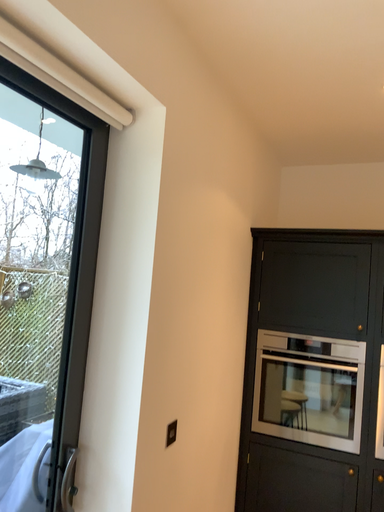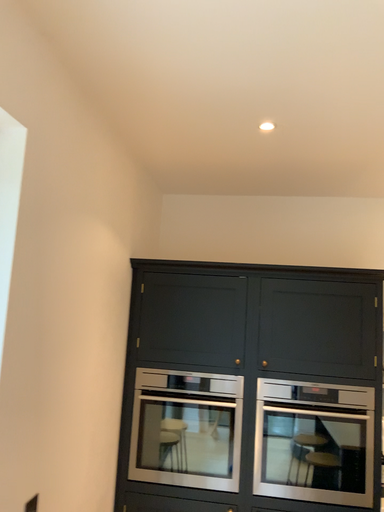
Question: How did the camera likely rotate when shooting the video?

Choices:
 (A) rotated right
 (B) rotated left

Answer: (A)